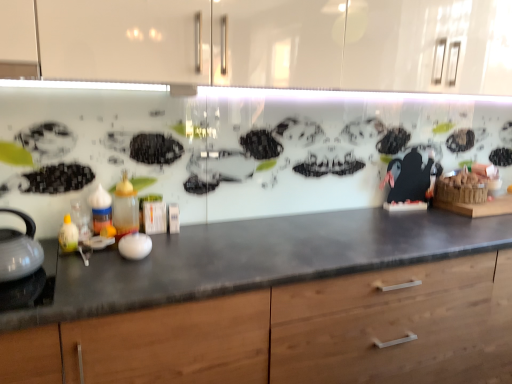
Question: Is the depth of translucent plastic bottle at center, which is the 1th bottle from right to left, greater than that of translucent plastic bottle at left, placed as the 1th bottle when sorted from left to right?

Choices:
 (A) yes
 (B) no

Answer: (A)

Question: From a real-world perspective, is translucent plastic bottle at center, which is the 2th bottle from left to right, physically above translucent plastic bottle at left, the second bottle from the right?

Choices:
 (A) no
 (B) yes

Answer: (B)

Question: Can you confirm if translucent plastic bottle at center, which is the 2th bottle from left to right, is positioned to the right of translucent plastic bottle at left, placed as the 1th bottle when sorted from left to right?

Choices:
 (A) yes
 (B) no

Answer: (A)

Question: From the image's perspective, is translucent plastic bottle at center, which is the 1th bottle from right to left, below translucent plastic bottle at left, placed as the 1th bottle when sorted from left to right?

Choices:
 (A) no
 (B) yes

Answer: (A)

Question: Considering the relative sizes of translucent plastic bottle at center, which is the 1th bottle from right to left, and translucent plastic bottle at left, the second bottle from the right, in the image provided, is translucent plastic bottle at center, which is the 1th bottle from right to left, shorter than translucent plastic bottle at left, the second bottle from the right,?

Choices:
 (A) yes
 (B) no

Answer: (B)

Question: In terms of width, does translucent plastic bottle at left, the second bottle from the right, look wider or thinner when compared to white glossy tea pot at left?

Choices:
 (A) wide
 (B) thin

Answer: (B)

Question: In terms of height, does translucent plastic bottle at left, placed as the 1th bottle when sorted from left to right, look taller or shorter compared to white glossy tea pot at left?

Choices:
 (A) short
 (B) tall

Answer: (A)

Question: Considering the positions of translucent plastic bottle at left, placed as the 1th bottle when sorted from left to right, and white glossy tea pot at left in the image, is translucent plastic bottle at left, placed as the 1th bottle when sorted from left to right, bigger or smaller than white glossy tea pot at left?

Choices:
 (A) small
 (B) big

Answer: (A)

Question: From a real-world perspective, is translucent plastic bottle at left, the second bottle from the right, positioned above or below white glossy tea pot at left?

Choices:
 (A) above
 (B) below

Answer: (B)

Question: Is translucent plastic bottle at left, the second bottle from the right, taller or shorter than translucent plastic bottle at center, which is the 2th bottle from left to right?

Choices:
 (A) short
 (B) tall

Answer: (A)

Question: From the image's perspective, is translucent plastic bottle at left, placed as the 1th bottle when sorted from left to right, located above or below translucent plastic bottle at center, which is the 2th bottle from left to right?

Choices:
 (A) above
 (B) below

Answer: (B)

Question: Based on their sizes in the image, would you say translucent plastic bottle at left, placed as the 1th bottle when sorted from left to right, is bigger or smaller than translucent plastic bottle at center, which is the 1th bottle from right to left?

Choices:
 (A) big
 (B) small

Answer: (B)

Question: Considering the positions of translucent plastic bottle at left, placed as the 1th bottle when sorted from left to right, and translucent plastic bottle at center, which is the 1th bottle from right to left, in the image, is translucent plastic bottle at left, placed as the 1th bottle when sorted from left to right, wider or thinner than translucent plastic bottle at center, which is the 1th bottle from right to left,?

Choices:
 (A) thin
 (B) wide

Answer: (B)

Question: In terms of height, does wooden cabinet at center look taller or shorter compared to white glossy tea pot at left?

Choices:
 (A) tall
 (B) short

Answer: (A)

Question: Is point (279, 375) positioned closer to the camera than point (19, 241)?

Choices:
 (A) farther
 (B) closer

Answer: (A)